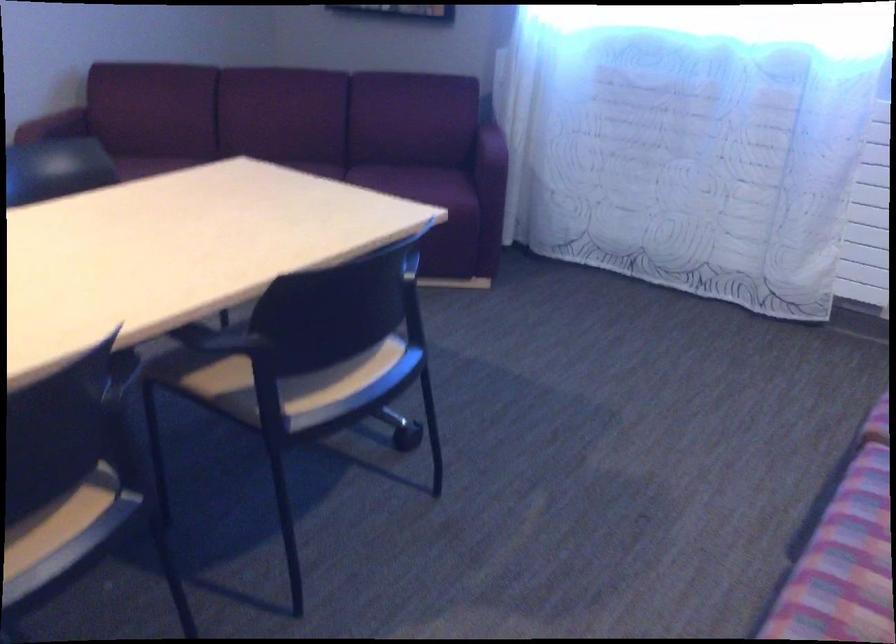
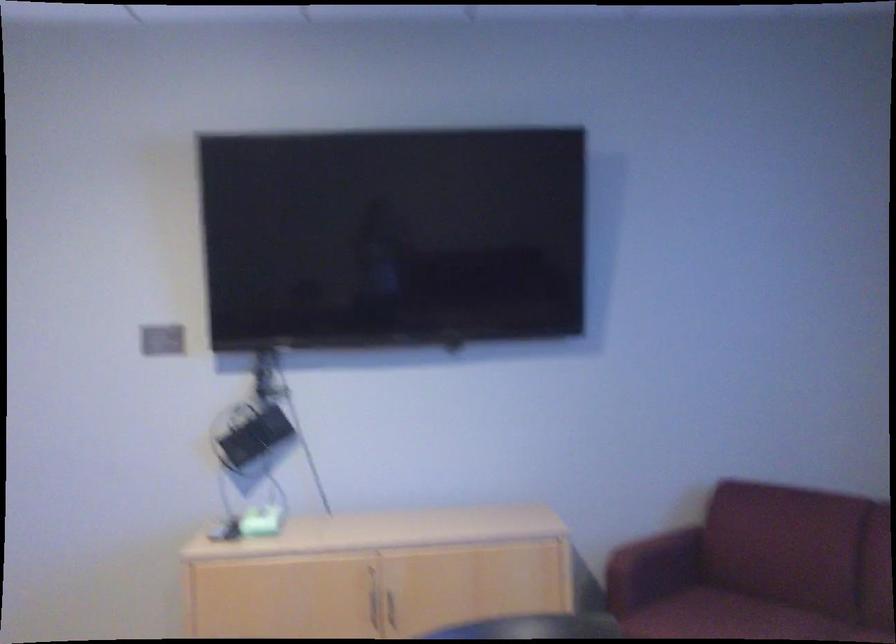
Locate, in the second image, the point that corresponds to [121,161] in the first image.

(722, 616)